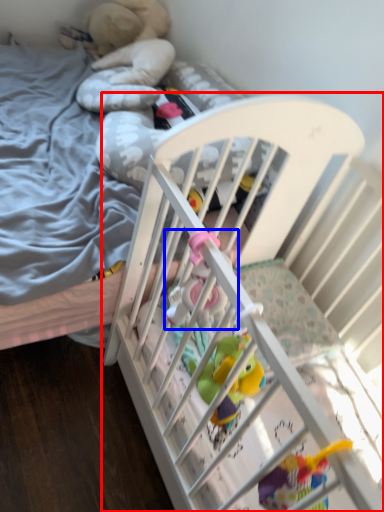
Question: Among these objects, which one is farthest to the camera, infant bed (highlighted by a red box) or toy (highlighted by a blue box)?

Choices:
 (A) infant bed
 (B) toy

Answer: (A)